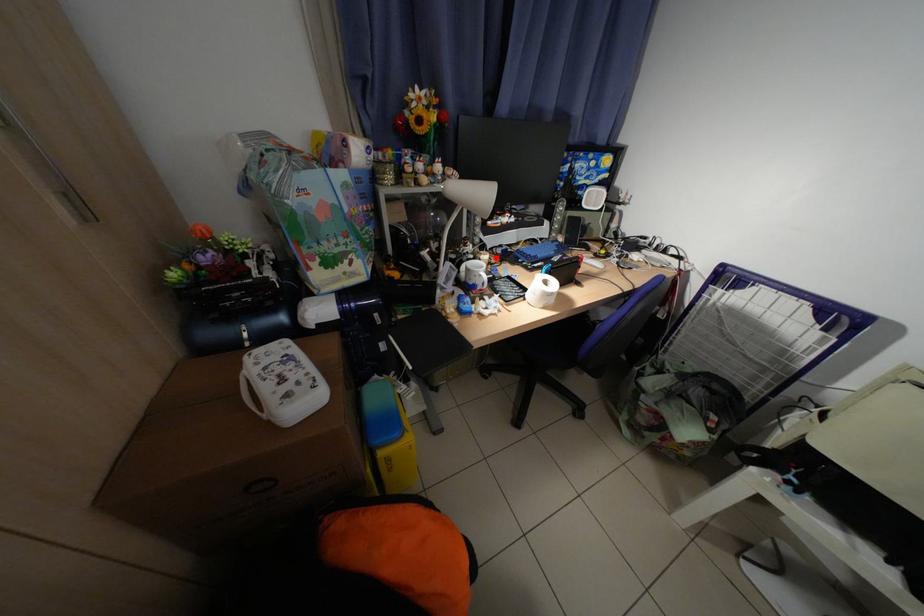
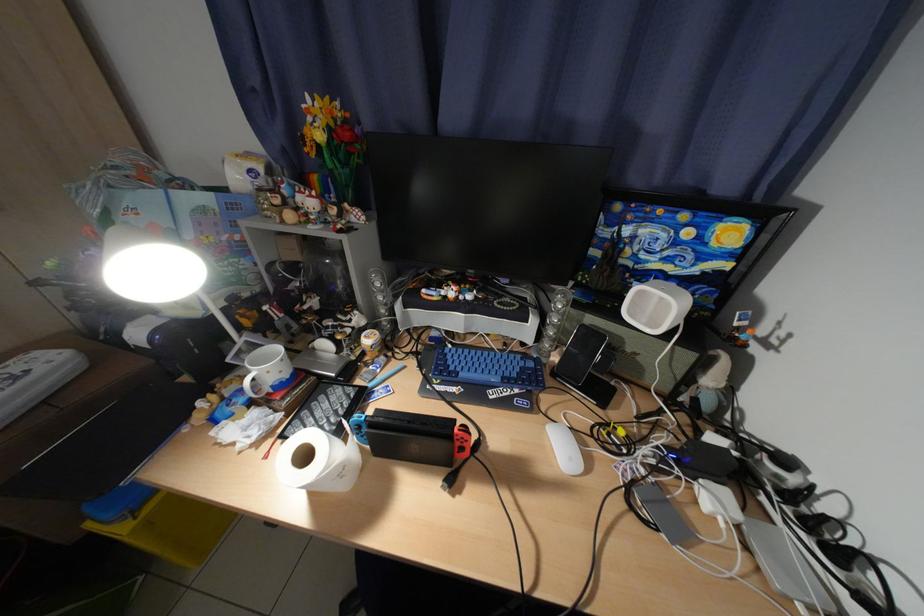
Find the pixel in the second image that matches the highlighted location in the first image.

(381, 341)